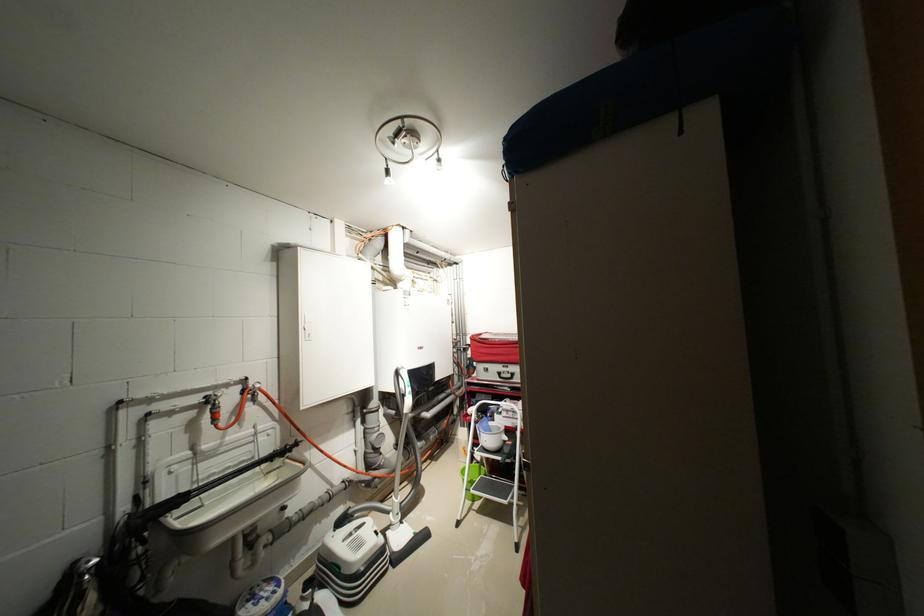
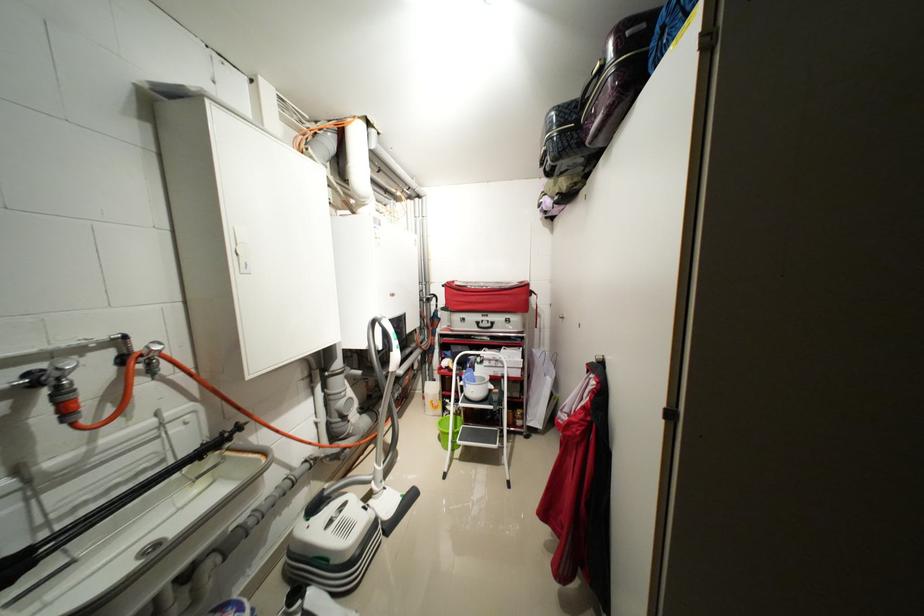
Question: The camera is either moving clockwise (left) or counter-clockwise (right) around the object. The first image is from the beginning of the video and the second image is from the end. Is the camera moving left or right when shooting the video?

Choices:
 (A) Left
 (B) Right

Answer: (A)